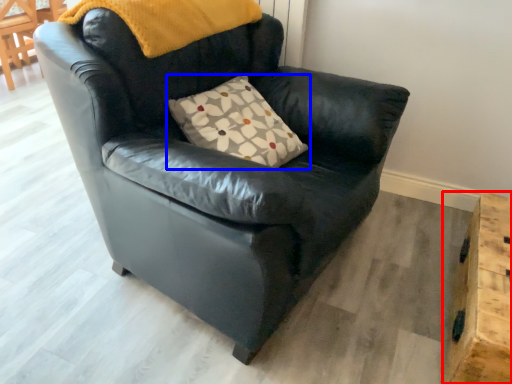
Question: Which object is further to the camera taking this photo, table (highlighted by a red box) or pillow (highlighted by a blue box)?

Choices:
 (A) table
 (B) pillow

Answer: (B)